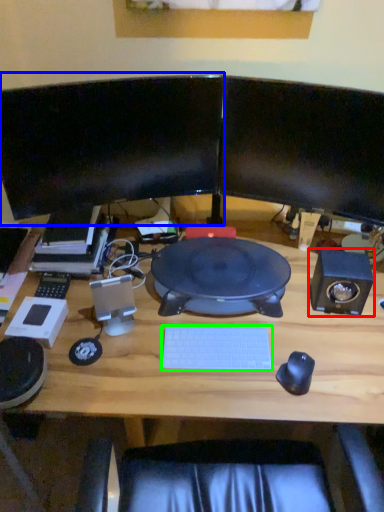
Question: Based on their relative distances, which object is nearer to speaker (highlighted by a red box)? Choose from computer monitor (highlighted by a blue box) and computer keyboard (highlighted by a green box).

Choices:
 (A) computer monitor
 (B) computer keyboard

Answer: (B)